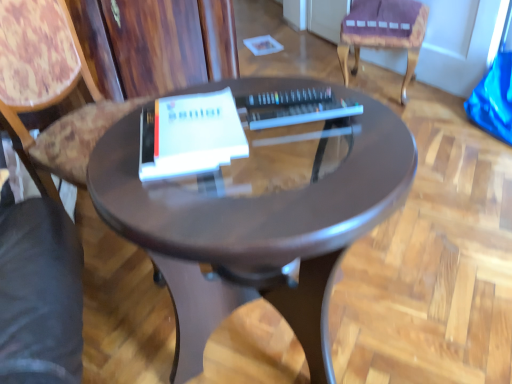
Find the location of a particular element. The width and height of the screenshot is (512, 384). wooden at left, which is the first chair from left to right is located at coordinates (48, 91).

What is the approximate width of white matte paperback book at center?

It is 7.02 inches.

Describe the element at coordinates (256, 229) in the screenshot. I see `glossy brown table at center` at that location.

The height and width of the screenshot is (384, 512). Identify the location of wooden at left, arranged as the 1th chair when viewed from the front. (48, 91).

Is white matte paperback book at center oriented towards glossy brown table at center?

No, white matte paperback book at center is not facing towards glossy brown table at center.

Can you confirm if white matte paperback book at center is bigger than glossy brown table at center?

Actually, white matte paperback book at center might be smaller than glossy brown table at center.

Considering the sizes of objects white matte paperback book at center and glossy brown table at center in the image provided, who is wider, white matte paperback book at center or glossy brown table at center?

With larger width is glossy brown table at center.

Measure the distance between glossy brown table at center and purple fabric cushion at upper right, the 1th chair from the right.

A distance of 1.26 meters exists between glossy brown table at center and purple fabric cushion at upper right, the 1th chair from the right.

Which object is thinner, glossy brown table at center or purple fabric cushion at upper right, arranged as the 1th chair when viewed from the back?

With smaller width is purple fabric cushion at upper right, arranged as the 1th chair when viewed from the back.

From the image's perspective, which is below, glossy brown table at center or purple fabric cushion at upper right, the 2th chair viewed from the front?

glossy brown table at center appears lower in the image.

From a real-world perspective, relative to wooden at left, the 2th chair when ordered from back to front, is glossy brown table at center vertically above or below?

glossy brown table at center is situated lower than wooden at left, the 2th chair when ordered from back to front, in the real world.

Measure the distance between glossy brown table at center and wooden at left, arranged as the 1th chair when viewed from the front.

A distance of 18.11 inches exists between glossy brown table at center and wooden at left, arranged as the 1th chair when viewed from the front.

Which point is more forward, (323, 229) or (25, 131)?

The point (323, 229) is more forward.

From the image's perspective, is glossy brown table at center under wooden at left, which is the first chair from left to right?

Correct, glossy brown table at center appears lower than wooden at left, which is the first chair from left to right, in the image.

What's the angular difference between purple fabric cushion at upper right, arranged as the 1th chair when viewed from the back, and glossy brown table at center's facing directions?

The facing directions of purple fabric cushion at upper right, arranged as the 1th chair when viewed from the back, and glossy brown table at center are 135 degrees apart.

Which object is closer to the camera taking this photo, purple fabric cushion at upper right, the 1th chair from the right, or glossy brown table at center?

glossy brown table at center is closer to the camera.

From the image's perspective, is purple fabric cushion at upper right, the 2th chair viewed from the front, located above or below glossy brown table at center?

purple fabric cushion at upper right, the 2th chair viewed from the front, is situated higher than glossy brown table at center in the image.

Does white matte paperback book at center have a greater height compared to purple fabric cushion at upper right, the 1th chair from the right?

No.

Is white matte paperback book at center placed right next to purple fabric cushion at upper right, the 2th chair when ordered from left to right?

There is a gap between white matte paperback book at center and purple fabric cushion at upper right, the 2th chair when ordered from left to right.

Which is correct: white matte paperback book at center is inside purple fabric cushion at upper right, arranged as the 1th chair when viewed from the back, or outside of it?

white matte paperback book at center exists outside the volume of purple fabric cushion at upper right, arranged as the 1th chair when viewed from the back.

Can you tell me how much white matte paperback book at center and purple fabric cushion at upper right, the 2th chair viewed from the front, differ in facing direction?

There is a 126-degree angle between the facing directions of white matte paperback book at center and purple fabric cushion at upper right, the 2th chair viewed from the front.

Consider the image. How far apart are purple fabric cushion at upper right, arranged as the 1th chair when viewed from the back, and wooden at left, the 2th chair when ordered from back to front?

purple fabric cushion at upper right, arranged as the 1th chair when viewed from the back, is 4.47 feet from wooden at left, the 2th chair when ordered from back to front.

Are purple fabric cushion at upper right, the 2th chair viewed from the front, and wooden at left, arranged as the 1th chair when viewed from the front, beside each other?

There is a gap between purple fabric cushion at upper right, the 2th chair viewed from the front, and wooden at left, arranged as the 1th chair when viewed from the front.

From the image's perspective, is purple fabric cushion at upper right, the 1th chair from the right, above or below wooden at left, which ranks as the 2th chair in right-to-left order?

Based on their image positions, purple fabric cushion at upper right, the 1th chair from the right, is located above wooden at left, which ranks as the 2th chair in right-to-left order.

Locate an element on the screen. chair that is in front of the purple fabric cushion at upper right, the 2th chair when ordered from left to right is located at coordinates (48, 91).

Is the depth of wooden at left, which ranks as the 2th chair in right-to-left order, less than that of purple fabric cushion at upper right, the 1th chair from the right?

Yes.

Is wooden at left, which is the first chair from left to right, facing towards purple fabric cushion at upper right, the 1th chair from the right?

No, wooden at left, which is the first chair from left to right, is not aimed at purple fabric cushion at upper right, the 1th chair from the right.

Is wooden at left, which is the first chair from left to right, with purple fabric cushion at upper right, the 2th chair when ordered from left to right?

No, wooden at left, which is the first chair from left to right, is not with purple fabric cushion at upper right, the 2th chair when ordered from left to right.

Locate an element on the screen. This screenshot has width=512, height=384. desk below the white matte paperback book at center (from a real-world perspective) is located at coordinates (256, 229).

Locate an element on the screen. This screenshot has height=384, width=512. the 2nd chair above when counting from the glossy brown table at center (from the image's perspective) is located at coordinates (383, 32).

Estimate the real-world distances between objects in this image. Which object is closer to purple fabric cushion at upper right, the 1th chair from the right, wooden at left, the 2th chair when ordered from back to front, or white matte paperback book at center?

Based on the image, wooden at left, the 2th chair when ordered from back to front, appears to be nearer to purple fabric cushion at upper right, the 1th chair from the right.

Considering their positions, is white matte paperback book at center positioned closer to glossy brown table at center than wooden at left, which ranks as the 2th chair in right-to-left order?

white matte paperback book at center lies closer to glossy brown table at center than the other object.

From the image, which object appears to be farther from wooden at left, arranged as the 1th chair when viewed from the front, purple fabric cushion at upper right, the 2th chair when ordered from left to right, or white matte paperback book at center?

purple fabric cushion at upper right, the 2th chair when ordered from left to right, is positioned further to the anchor wooden at left, arranged as the 1th chair when viewed from the front.

Based on their spatial positions, is glossy brown table at center or white matte paperback book at center further from purple fabric cushion at upper right, the 2th chair viewed from the front?

Based on the image, white matte paperback book at center appears to be further to purple fabric cushion at upper right, the 2th chair viewed from the front.

Based on their spatial positions, is wooden at left, which is the first chair from left to right, or glossy brown table at center closer to purple fabric cushion at upper right, the 2th chair viewed from the front?

glossy brown table at center is closer to purple fabric cushion at upper right, the 2th chair viewed from the front.

Which object lies further to the anchor point wooden at left, the 2th chair when ordered from back to front, glossy brown table at center or white matte paperback book at center?

glossy brown table at center is further to wooden at left, the 2th chair when ordered from back to front.

From the image, which object appears to be nearer to glossy brown table at center, wooden at left, which ranks as the 2th chair in right-to-left order, or white matte paperback book at center?

white matte paperback book at center.

From the image, which object appears to be nearer to white matte paperback book at center, wooden at left, arranged as the 1th chair when viewed from the front, or purple fabric cushion at upper right, the 2th chair viewed from the front?

wooden at left, arranged as the 1th chair when viewed from the front, lies closer to white matte paperback book at center than the other object.

Where is `chair between glossy brown table at center and purple fabric cushion at upper right, the 2th chair when ordered from left to right, along the z-axis`? This screenshot has height=384, width=512. chair between glossy brown table at center and purple fabric cushion at upper right, the 2th chair when ordered from left to right, along the z-axis is located at coordinates (48, 91).

Locate an element on the screen. This screenshot has width=512, height=384. chair between white matte paperback book at center and purple fabric cushion at upper right, the 1th chair from the right, along the z-axis is located at coordinates (48, 91).

Find the location of a particular element. paperback book positioned between glossy brown table at center and purple fabric cushion at upper right, the 1th chair from the right, from near to far is located at coordinates (190, 135).

Image resolution: width=512 pixels, height=384 pixels. I want to click on paperback book between wooden at left, which is the first chair from left to right, and glossy brown table at center from left to right, so pos(190,135).